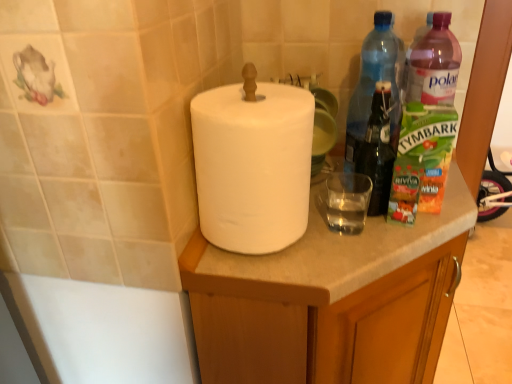
Identify the location of vacant space to the right of transparent glass at center. This screenshot has width=512, height=384. (412, 225).